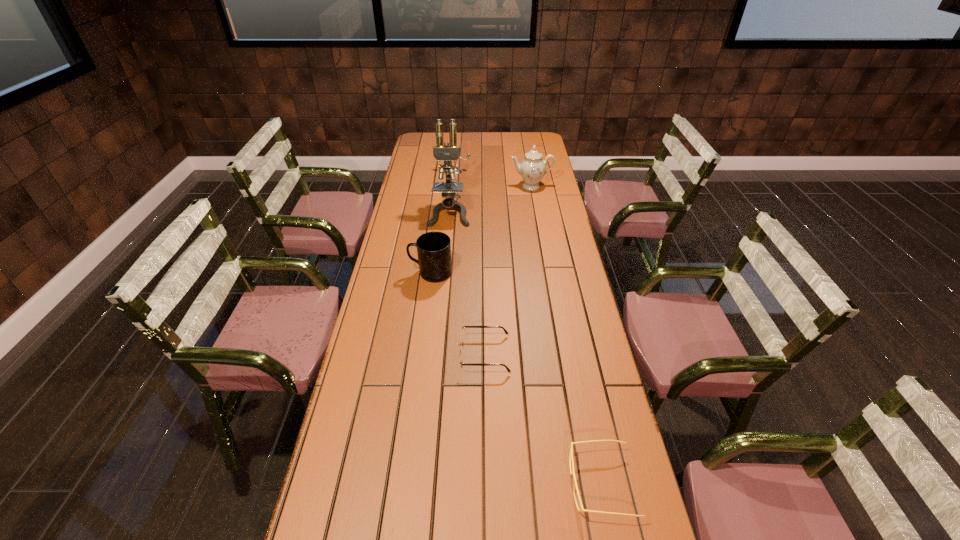
At what (x,y) coordinates should I click in order to perform the action: click on vacant space located 0.140m at the eyepieces of the tallest object. Please return your answer as a coordinate pair (x, y). The height and width of the screenshot is (540, 960). Looking at the image, I should click on coord(446,247).

Locate an element on the screen. The image size is (960, 540). free space located 0.340m on the spout of the chinaware is located at coordinates (540, 235).

Locate an element on the screen. Image resolution: width=960 pixels, height=540 pixels. vacant space located 0.220m on the front-facing side of the candle is located at coordinates (453, 198).

The width and height of the screenshot is (960, 540). Find the location of `blank space located on the side of the fourth farthest object with the handle`. blank space located on the side of the fourth farthest object with the handle is located at coordinates point(382,273).

I want to click on vacant area situated in front of the lenses of the nearer spectacles, so click(516, 484).

Where is `free region located in front of the lenses of the nearer spectacles`? The height and width of the screenshot is (540, 960). free region located in front of the lenses of the nearer spectacles is located at coordinates (549, 484).

This screenshot has height=540, width=960. I want to click on vacant region located in front of the lenses of the nearer spectacles, so click(482, 484).

In order to click on vacant space positioned at the hinge ends of the left spectacles in this screenshot , I will do `click(443, 354)`.

Identify the location of free space located at the hinge ends of the left spectacles. (433, 354).

The height and width of the screenshot is (540, 960). Identify the location of vacant space located 0.160m at the hinge ends of the left spectacles. (406, 354).